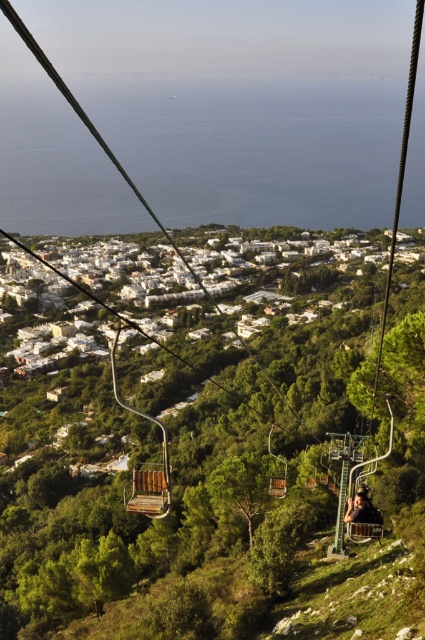
Is smooth brown hair at lower right taller than wooden bench at center?

No, smooth brown hair at lower right is not taller than wooden bench at center.

Does smooth brown hair at lower right have a smaller size compared to wooden bench at center?

No, smooth brown hair at lower right is not smaller than wooden bench at center.

Measure the distance between smooth brown hair at lower right and camera.

smooth brown hair at lower right is 52.86 meters from camera.

Identify the location of smooth brown hair at lower right. This screenshot has width=425, height=640. (362, 509).